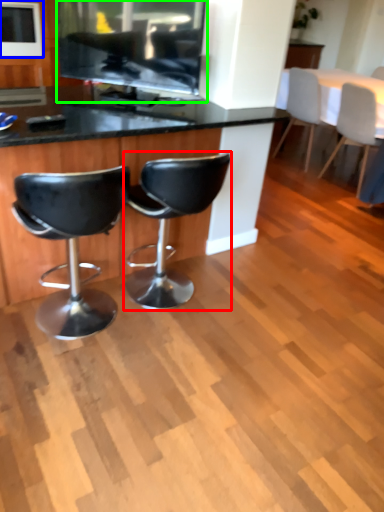
Question: Estimate the real-world distances between objects in this image. Which object is closer to chair (highlighted by a red box), appliance (highlighted by a blue box) or appliance (highlighted by a green box)?

Choices:
 (A) appliance
 (B) appliance

Answer: (B)